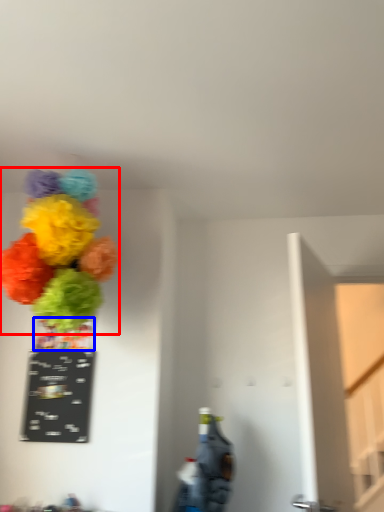
Question: Among these objects, which one is farthest to the camera, flower (highlighted by a red box) or vase (highlighted by a blue box)?

Choices:
 (A) flower
 (B) vase

Answer: (B)